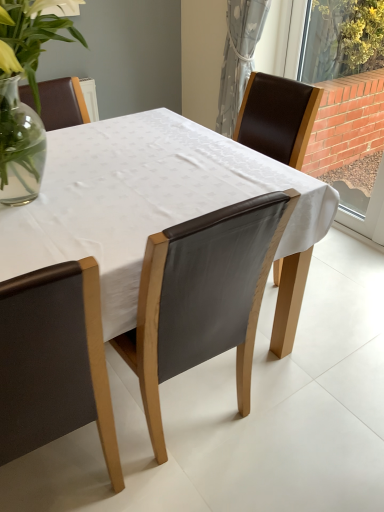
Question: Based on their sizes in the image, would you say brick wall at right is bigger or smaller than matte brown leather chair at lower left, placed as the 1th chair when sorted from left to right?

Choices:
 (A) small
 (B) big

Answer: (A)

Question: From a real-world perspective, is brick wall at right above or below matte brown leather chair at lower left, which is the 2th chair from right to left?

Choices:
 (A) below
 (B) above

Answer: (B)

Question: Considering the real-world distances, which object is farthest from the matte brown leather chair at lower left, which is the 2th chair from right to left?

Choices:
 (A) brick wall at right
 (B) white fabric table at center
 (C) gray textured curtain at upper right
 (D) leather at center, arranged as the first chair when viewed from the right

Answer: (A)

Question: Which of these objects is positioned closest to the gray textured curtain at upper right?

Choices:
 (A) matte brown leather chair at lower left, which is the 2th chair from right to left
 (B) brick wall at right
 (C) white fabric table at center
 (D) leather at center, arranged as the first chair when viewed from the right

Answer: (B)